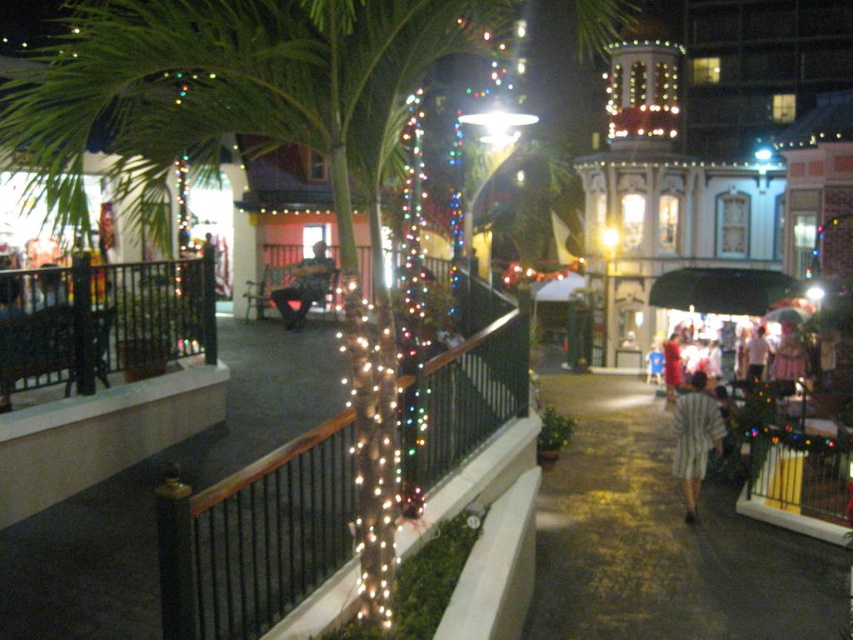
You are standing on the walkway and want to move towards the stage area. There are two points marked on the path ahead of you at coordinates point (712,444) and point (753,353). Which point should you aim for to get closer to the stage area?

Point (712,444) is in front of point (753,353), so aiming for point (712,444) will bring you closer to the stage area.

You are standing on the walkway and want to take a photo of both the white glossy building at center and the white cotton shirt at center. Which object should you focus on first to ensure it appears larger in your photo?

The white glossy building at center is much taller than the white cotton shirt at center, so focusing on it first will ensure it appears larger in your photo.

You are standing at the point marked as point (660, 538) in the image. What is the material of the surface you are currently standing on?

The surface at point (660, 538) is dark asphalt pavement at lower center.